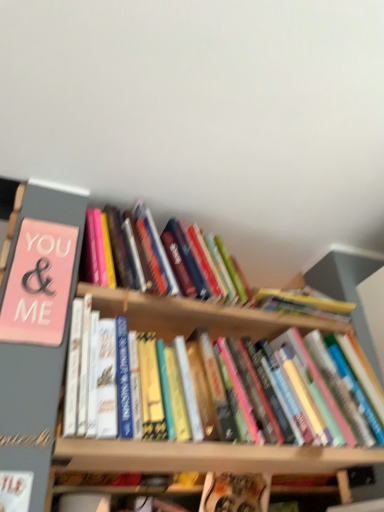
Question: From a real-world perspective, is hardcover book at center, marked as the 1th book in a top-to-bottom arrangement, on hardcover book at center, acting as the 5th book starting from the top?

Choices:
 (A) no
 (B) yes

Answer: (B)

Question: Does hardcover book at center, which is counted as the 5th book, starting from the bottom, have a larger size compared to hardcover book at center, which ranks as the first book in bottom-to-top order?

Choices:
 (A) no
 (B) yes

Answer: (B)

Question: Is hardcover book at center, which is counted as the 5th book, starting from the bottom, positioned in front of hardcover book at center, acting as the 5th book starting from the top?

Choices:
 (A) no
 (B) yes

Answer: (B)

Question: Is hardcover book at center, marked as the 1th book in a top-to-bottom arrangement, at the right side of hardcover book at center, which ranks as the first book in bottom-to-top order?

Choices:
 (A) yes
 (B) no

Answer: (B)

Question: Looking at the image, does hardcover book at center, which ranks as the 3th book in top-to-bottom order, seem bigger or smaller compared to hardcover book at center, which ranks as the first book in bottom-to-top order?

Choices:
 (A) small
 (B) big

Answer: (B)

Question: From a real-world perspective, is hardcover book at center, which ranks as the 3th book in top-to-bottom order, above or below hardcover book at center, acting as the 5th book starting from the top?

Choices:
 (A) above
 (B) below

Answer: (A)

Question: Does point (334, 329) appear closer or farther from the camera than point (258, 487)?

Choices:
 (A) closer
 (B) farther

Answer: (A)

Question: Is hardcover book at center, which ranks as the 3th book in top-to-bottom order, to the left or to the right of hardcover book at center, which ranks as the first book in bottom-to-top order, in the image?

Choices:
 (A) right
 (B) left

Answer: (B)

Question: Based on their positions, is hardcover book at center, which ranks as the 3th book in top-to-bottom order, located to the left or right of white paper at lower left, which ranks as the second book in bottom-to-top order?

Choices:
 (A) left
 (B) right

Answer: (B)

Question: Is point (92, 304) closer or farther from the camera than point (16, 471)?

Choices:
 (A) closer
 (B) farther

Answer: (B)

Question: Based on their sizes in the image, would you say hardcover book at center, which ranks as the 3th book in top-to-bottom order, is bigger or smaller than white paper at lower left, which ranks as the second book in bottom-to-top order?

Choices:
 (A) big
 (B) small

Answer: (A)

Question: Relative to white paper at lower left, which is the 4th book from top to bottom, is hardcover book at center, the 3th book when ordered from bottom to top, in front or behind?

Choices:
 (A) front
 (B) behind

Answer: (B)

Question: Which is correct: white paper at lower left, which ranks as the second book in bottom-to-top order, is inside hardcover book at center, which is counted as the 5th book, starting from the bottom, or outside of it?

Choices:
 (A) outside
 (B) inside

Answer: (A)

Question: In the image, is white paper at lower left, which is the 4th book from top to bottom, positioned in front of or behind hardcover book at center, marked as the 1th book in a top-to-bottom arrangement?

Choices:
 (A) behind
 (B) front

Answer: (B)